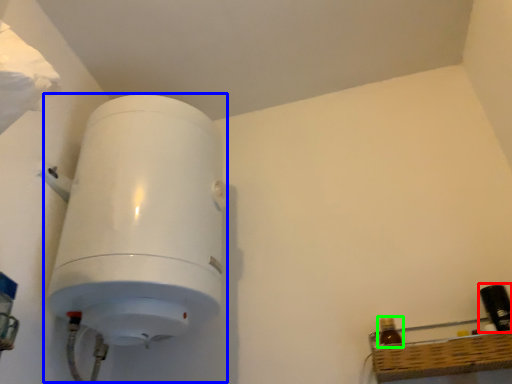
Question: Which object is the closest to the bottle (highlighted by a red box)? Choose among these: appliance (highlighted by a blue box) or bottle (highlighted by a green box).

Choices:
 (A) appliance
 (B) bottle

Answer: (B)